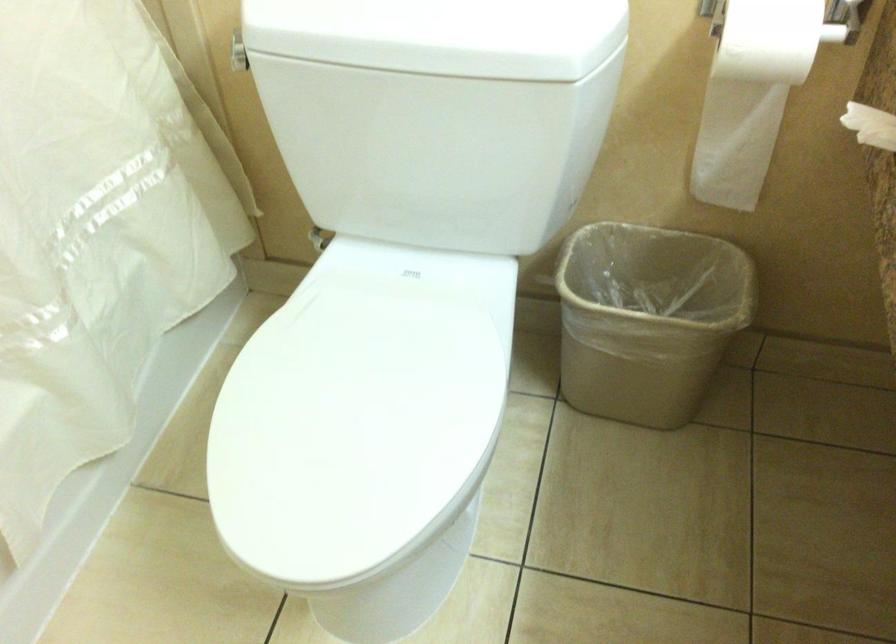
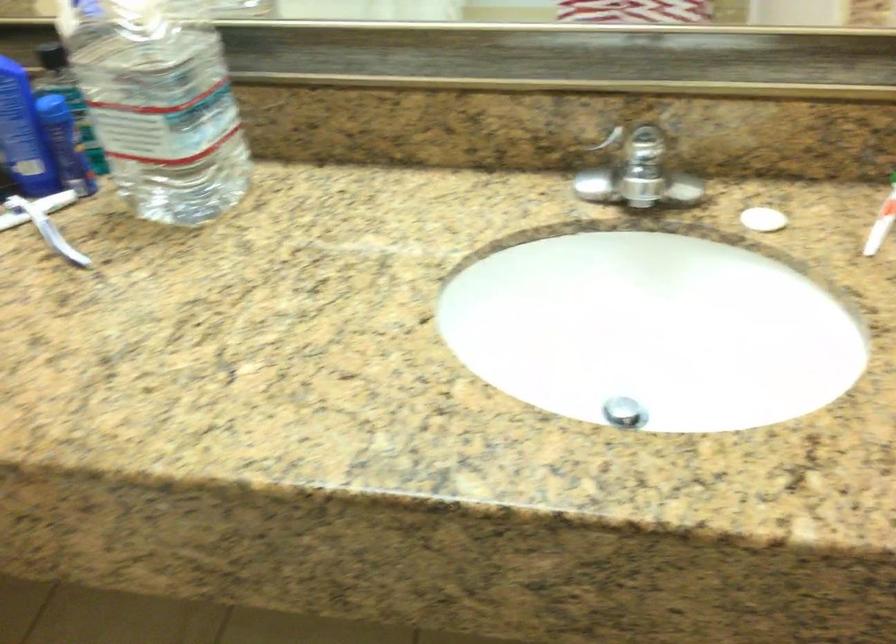
The images are taken continuously from a first-person perspective. In which direction is your viewpoint rotating?

The camera rotated toward right-down.